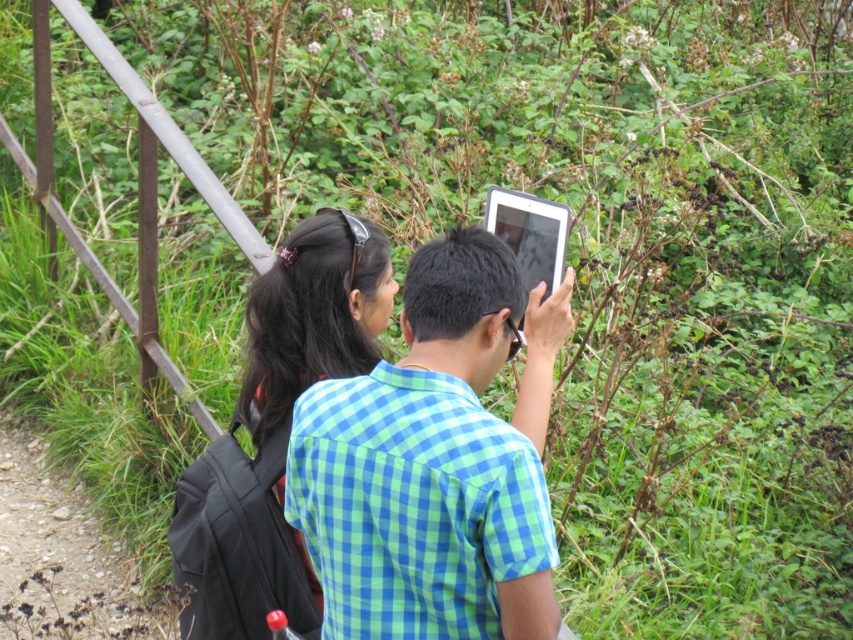
You are a photographer trying to capture a clear shot of the silver metallic tablet at center. However, the black hair at upper center is blocking your view. Can you move to the right or left to avoid the obstruction?

The black hair at upper center is to the left of the silver metallic tablet at center, so moving to the right side would allow you to avoid the obstruction caused by the black hair at upper center.